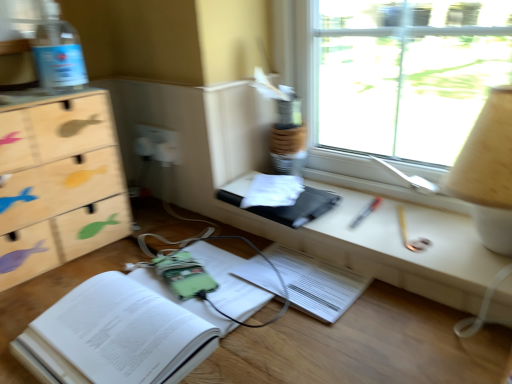
The image size is (512, 384). Find the location of `vacant region to the left of beige fabric lampshade at upper right`. vacant region to the left of beige fabric lampshade at upper right is located at coordinates (387, 229).